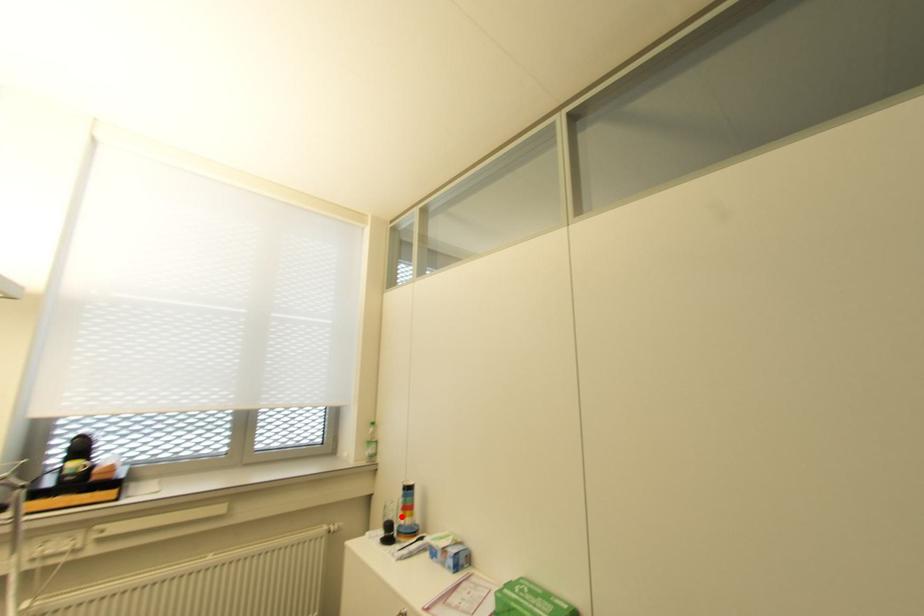
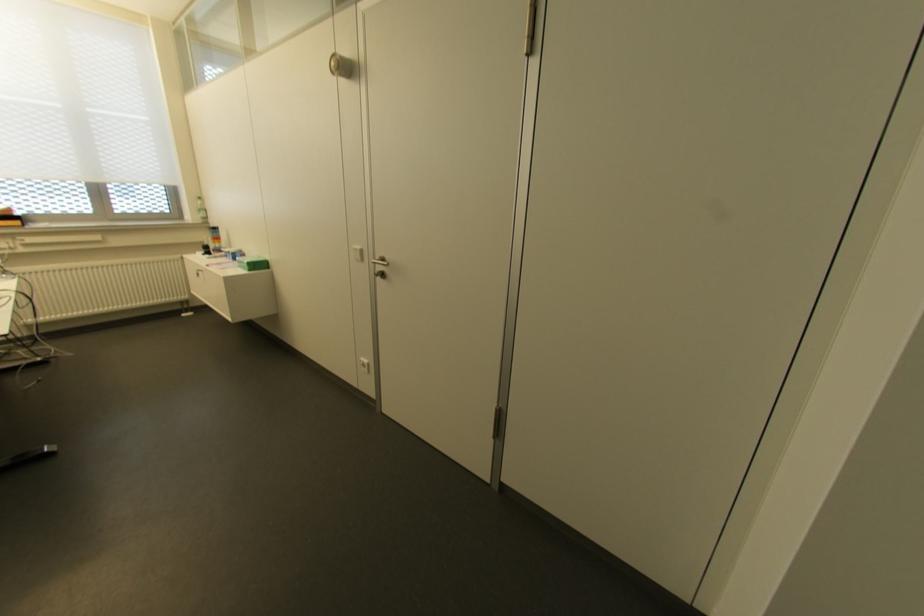
Question: I am providing you with two images of the same scene from different viewpoints. A red point is marked on the first image. At the location where the point appears in image 1, is it still visible in image 2?

Choices:
 (A) Yes
 (B) No

Answer: (A)